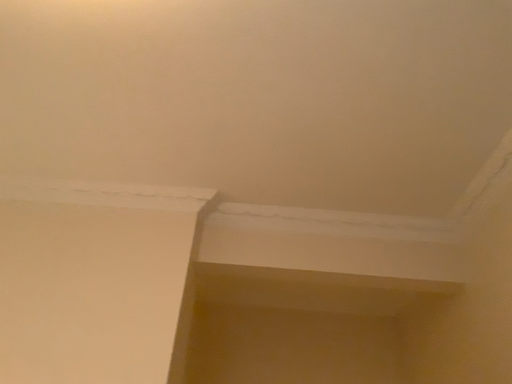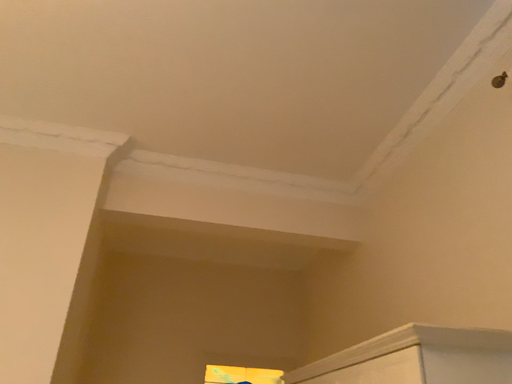
Question: Which way did the camera rotate in the video?

Choices:
 (A) rotated right
 (B) rotated left

Answer: (A)